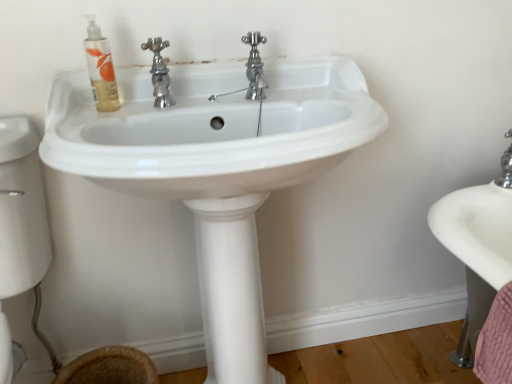
Question: Can you confirm if white glossy sink at center is taller than brown woven basket at lower left?

Choices:
 (A) no
 (B) yes

Answer: (B)

Question: Is brown woven basket at lower left inside white glossy sink at center?

Choices:
 (A) no
 (B) yes

Answer: (B)

Question: Can we say white glossy sink at center lies outside brown woven basket at lower left?

Choices:
 (A) no
 (B) yes

Answer: (B)

Question: Is white glossy sink at center in front of brown woven basket at lower left?

Choices:
 (A) no
 (B) yes

Answer: (B)

Question: Are white glossy sink at center and brown woven basket at lower left beside each other?

Choices:
 (A) no
 (B) yes

Answer: (A)

Question: Is the position of white glossy sink at center more distant than that of brown woven basket at lower left?

Choices:
 (A) no
 (B) yes

Answer: (A)

Question: Is brown woven basket at lower left thinner than translucent gel mouthwash at upper left?

Choices:
 (A) yes
 (B) no

Answer: (B)

Question: Could you tell me if brown woven basket at lower left is turned towards translucent gel mouthwash at upper left?

Choices:
 (A) no
 (B) yes

Answer: (A)

Question: From a real-world perspective, is brown woven basket at lower left located higher than translucent gel mouthwash at upper left?

Choices:
 (A) yes
 (B) no

Answer: (B)

Question: Considering the relative sizes of brown woven basket at lower left and translucent gel mouthwash at upper left in the image provided, is brown woven basket at lower left smaller than translucent gel mouthwash at upper left?

Choices:
 (A) yes
 (B) no

Answer: (B)

Question: Is brown woven basket at lower left positioned with its back to translucent gel mouthwash at upper left?

Choices:
 (A) no
 (B) yes

Answer: (A)

Question: From a real-world perspective, is brown woven basket at lower left beneath translucent gel mouthwash at upper left?

Choices:
 (A) no
 (B) yes

Answer: (B)

Question: Is brown woven basket at lower left taller than white glossy sink at center?

Choices:
 (A) no
 (B) yes

Answer: (A)